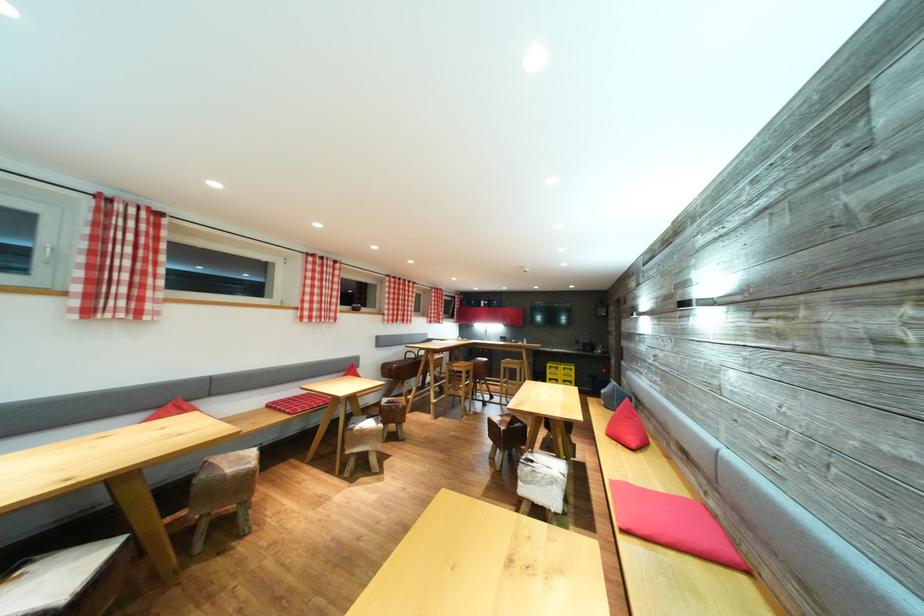
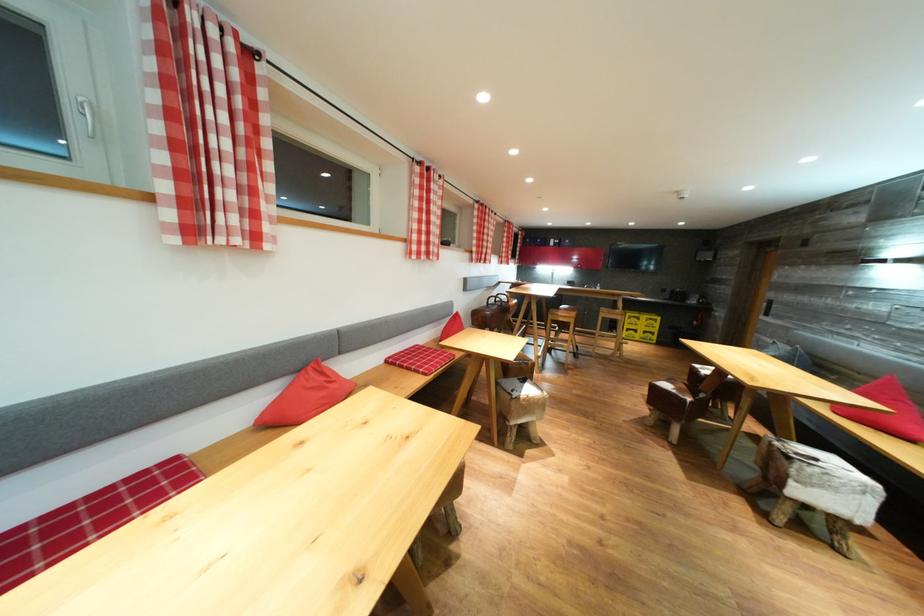
Find the pixel in the second image that matches (419,361) in the first image.

(499, 306)